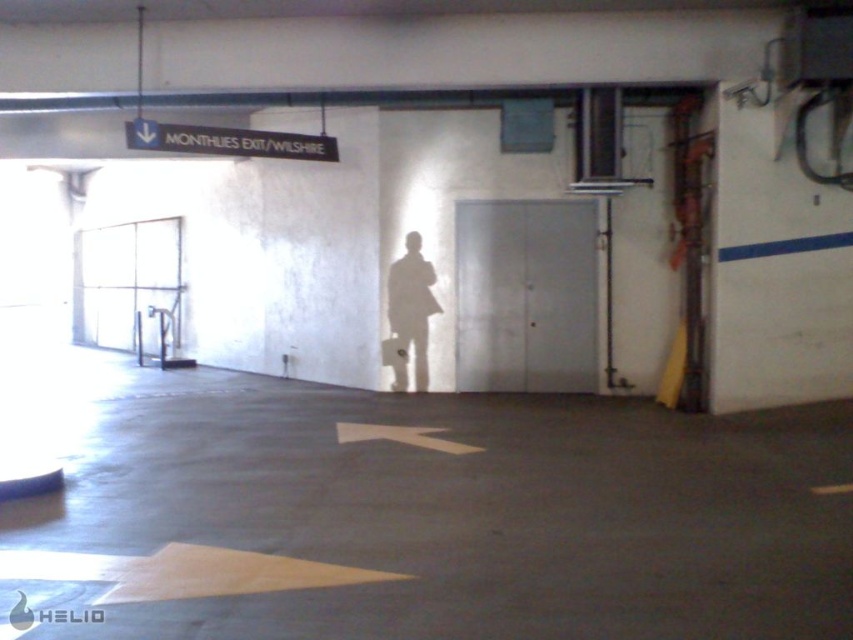
Does point (627, 577) come behind point (256, 147)?

No, it is in front of (256, 147).

This screenshot has height=640, width=853. What do you see at coordinates (415, 512) in the screenshot?
I see `concrete floor at center` at bounding box center [415, 512].

You are a GUI agent. You are given a task and a screenshot of the screen. Output one action in this format:
    pyautogui.click(x=<x>, y=<y>)
    Task: Click on the concrete floor at center
    This screenshot has width=853, height=640.
    Given the screenshot: What is the action you would take?
    pyautogui.click(x=415, y=512)

Is the position of concrete floor at center less distant than that of transparent glass elevator at left?

Yes, it is.

Consider the image. Can you confirm if concrete floor at center is positioned to the right of transparent glass elevator at left?

Indeed, concrete floor at center is positioned on the right side of transparent glass elevator at left.

Between point (258, 598) and point (90, 333), which one is positioned in front?

Point (258, 598) is in front.

This screenshot has width=853, height=640. In order to click on concrete floor at center in this screenshot , I will do `click(415, 512)`.

Does concrete floor at center appear over white matte coat at center?

No, concrete floor at center is not above white matte coat at center.

Who is taller, concrete floor at center or white matte coat at center?

Standing taller between the two is white matte coat at center.

Does point (560, 593) lie behind point (392, 314)?

No, it is in front of (392, 314).

I want to click on concrete floor at center, so click(415, 512).